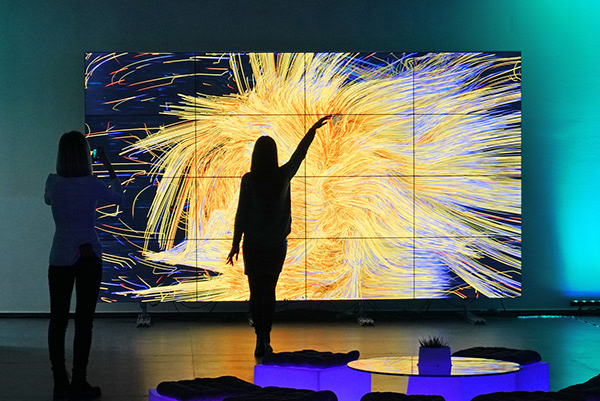
Identify the location of cushions. The height and width of the screenshot is (401, 600). (521, 354), (324, 357), (213, 382), (390, 397), (275, 389), (518, 392), (582, 382).